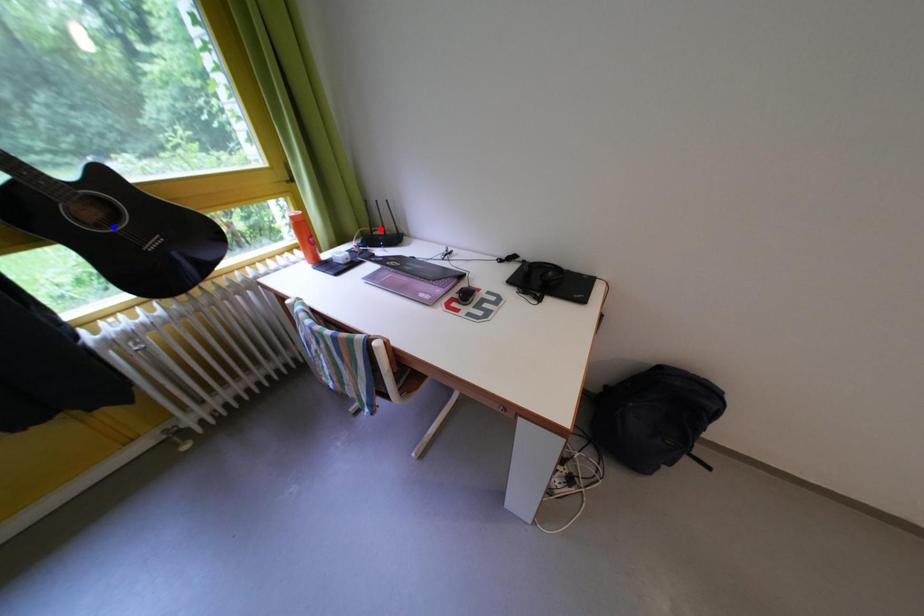
Question: Which of the two points in the image is closer to the camera?

Choices:
 (A) Blue point is closer.
 (B) Red point is closer.

Answer: (A)